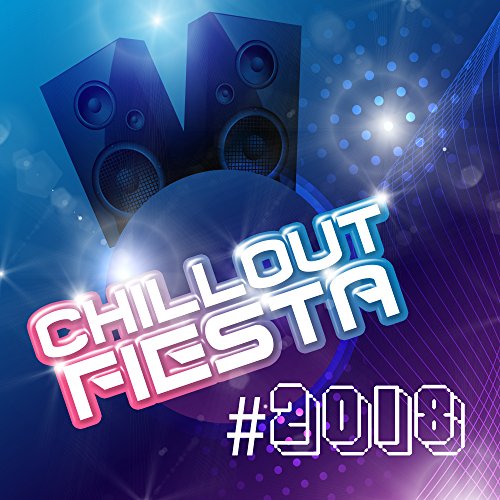
At what (x,y) coordinates should I click in order to perform the action: click on speakers. Please return your answer as a coordinate pair (x, y). This screenshot has width=500, height=500. Looking at the image, I should click on (135, 86), (213, 88).